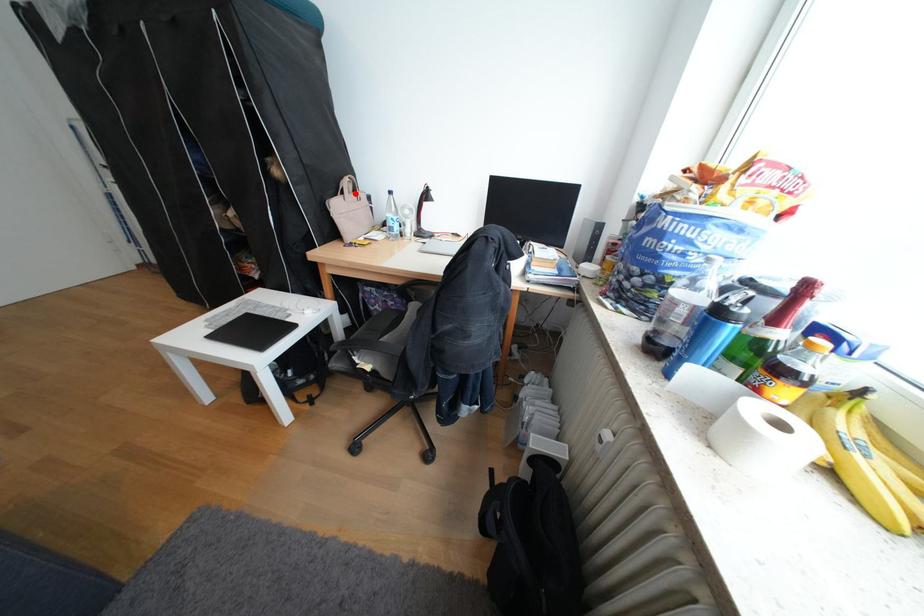
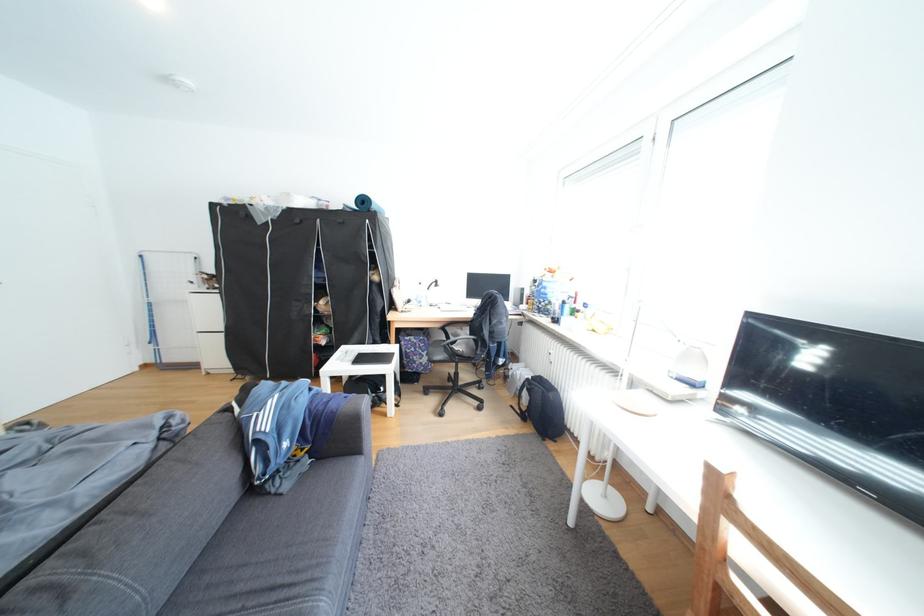
In the second image, find the point that corresponds to the highlighted location in the first image.

(408, 286)